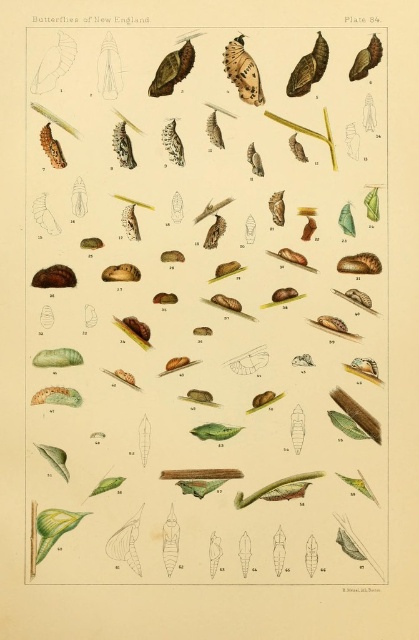
Question: Does green leafy plant at center have a lesser width compared to speckled brown butterfly at upper center?

Choices:
 (A) yes
 (B) no

Answer: (B)

Question: Among these points, which one is nearest to the camera?

Choices:
 (A) (243, 84)
 (B) (31, 468)

Answer: (A)

Question: Does green leafy plant at center appear over speckled brown butterfly at upper center?

Choices:
 (A) no
 (B) yes

Answer: (A)

Question: Which point appears closest to the camera in this image?

Choices:
 (A) (260, 81)
 (B) (287, 320)

Answer: (A)

Question: Among these points, which one is nearest to the camera?

Choices:
 (A) click(307, 35)
 (B) click(248, 88)

Answer: (A)

Question: Is green leafy plant at center positioned before speckled brown butterfly at upper center?

Choices:
 (A) no
 (B) yes

Answer: (B)